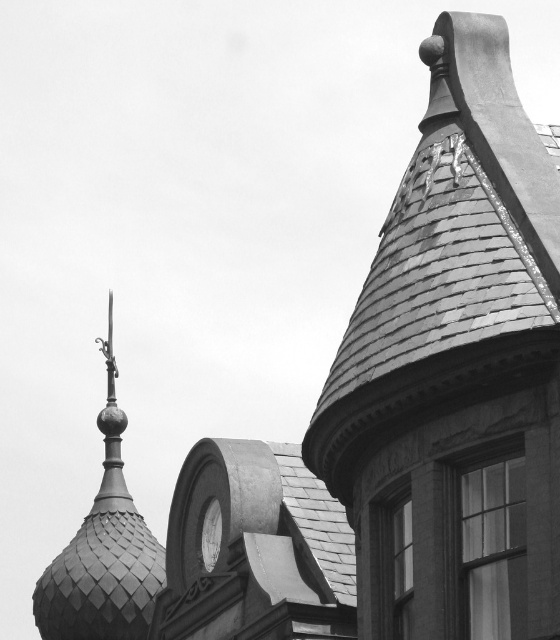
Question: Does shiny gray slate roof at upper right have a greater width compared to polished metal spire at upper left?

Choices:
 (A) no
 (B) yes

Answer: (A)

Question: Which of the following is the farthest from the observer?

Choices:
 (A) shiny gray slate roof at upper right
 (B) white glossy clock at center
 (C) polished metal spire at upper left

Answer: (C)

Question: Estimate the real-world distances between objects in this image. Which object is closer to the polished metal spire at upper left?

Choices:
 (A) white glossy clock at center
 (B) shiny gray slate roof at upper right

Answer: (A)

Question: Does shiny gray slate roof at upper right have a smaller size compared to white glossy clock at center?

Choices:
 (A) no
 (B) yes

Answer: (A)

Question: Does polished metal spire at upper left have a larger size compared to white glossy clock at center?

Choices:
 (A) no
 (B) yes

Answer: (B)

Question: Which point is closer to the camera taking this photo?

Choices:
 (A) (200, 536)
 (B) (115, 534)
 (C) (525, 209)

Answer: (C)